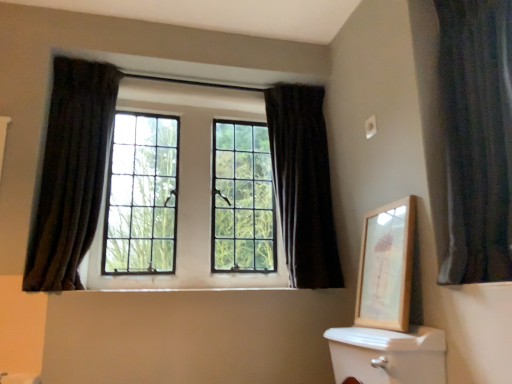
Question: Is matte glass windows at center not inside dark velvet curtain at upper center, the 2th curtain viewed from the left?

Choices:
 (A) yes
 (B) no

Answer: (A)

Question: Are matte glass windows at center and dark velvet curtain at upper center, marked as the second curtain in a right-to-left arrangement, beside each other?

Choices:
 (A) no
 (B) yes

Answer: (A)

Question: Is matte glass windows at center further to camera compared to dark velvet curtain at upper center, marked as the second curtain in a right-to-left arrangement?

Choices:
 (A) no
 (B) yes

Answer: (B)

Question: Is matte glass windows at center to the right of dark velvet curtain at upper center, the 2th curtain viewed from the left, from the viewer's perspective?

Choices:
 (A) no
 (B) yes

Answer: (A)

Question: From a real-world perspective, is matte glass windows at center physically below dark velvet curtain at upper center, marked as the second curtain in a right-to-left arrangement?

Choices:
 (A) no
 (B) yes

Answer: (A)

Question: From a real-world perspective, is matte glass windows at center physically located above or below dark velvet curtain at left, positioned as the 1th curtain in left-to-right order?

Choices:
 (A) above
 (B) below

Answer: (A)

Question: In the image, is matte glass windows at center positioned in front of or behind dark velvet curtain at left, the third curtain positioned from the right?

Choices:
 (A) front
 (B) behind

Answer: (B)

Question: Is matte glass windows at center bigger or smaller than dark velvet curtain at left, the third curtain positioned from the right?

Choices:
 (A) big
 (B) small

Answer: (A)

Question: In terms of height, does matte glass windows at center look taller or shorter compared to dark velvet curtain at left, the third curtain positioned from the right?

Choices:
 (A) short
 (B) tall

Answer: (A)

Question: Considering their positions, is dark velvet curtain at right, acting as the third curtain starting from the left, located in front of or behind dark velvet curtain at upper center, the 2th curtain viewed from the left?

Choices:
 (A) front
 (B) behind

Answer: (A)

Question: Considering the positions of dark velvet curtain at right, which is counted as the 1th curtain, starting from the right, and dark velvet curtain at upper center, marked as the second curtain in a right-to-left arrangement, in the image, is dark velvet curtain at right, which is counted as the 1th curtain, starting from the right, bigger or smaller than dark velvet curtain at upper center, marked as the second curtain in a right-to-left arrangement,?

Choices:
 (A) small
 (B) big

Answer: (A)

Question: Is dark velvet curtain at right, acting as the third curtain starting from the left, wider or thinner than dark velvet curtain at upper center, the 2th curtain viewed from the left?

Choices:
 (A) wide
 (B) thin

Answer: (B)

Question: From the image's perspective, is dark velvet curtain at right, which is counted as the 1th curtain, starting from the right, located above or below dark velvet curtain at upper center, marked as the second curtain in a right-to-left arrangement?

Choices:
 (A) below
 (B) above

Answer: (B)

Question: Considering the positions of dark velvet curtain at right, which is counted as the 1th curtain, starting from the right, and dark velvet curtain at left, positioned as the 1th curtain in left-to-right order, in the image, is dark velvet curtain at right, which is counted as the 1th curtain, starting from the right, wider or thinner than dark velvet curtain at left, positioned as the 1th curtain in left-to-right order,?

Choices:
 (A) thin
 (B) wide

Answer: (B)

Question: Considering their positions, is dark velvet curtain at right, which is counted as the 1th curtain, starting from the right, located in front of or behind dark velvet curtain at left, positioned as the 1th curtain in left-to-right order?

Choices:
 (A) front
 (B) behind

Answer: (A)